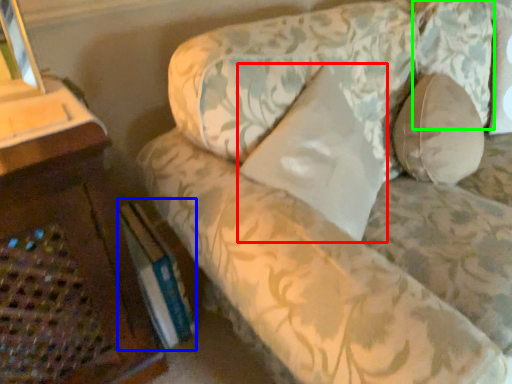
Question: Based on their relative distances, which object is farther from pillow (highlighted by a red box)? Choose from paperback book (highlighted by a blue box) and pillow (highlighted by a green box).

Choices:
 (A) paperback book
 (B) pillow

Answer: (B)